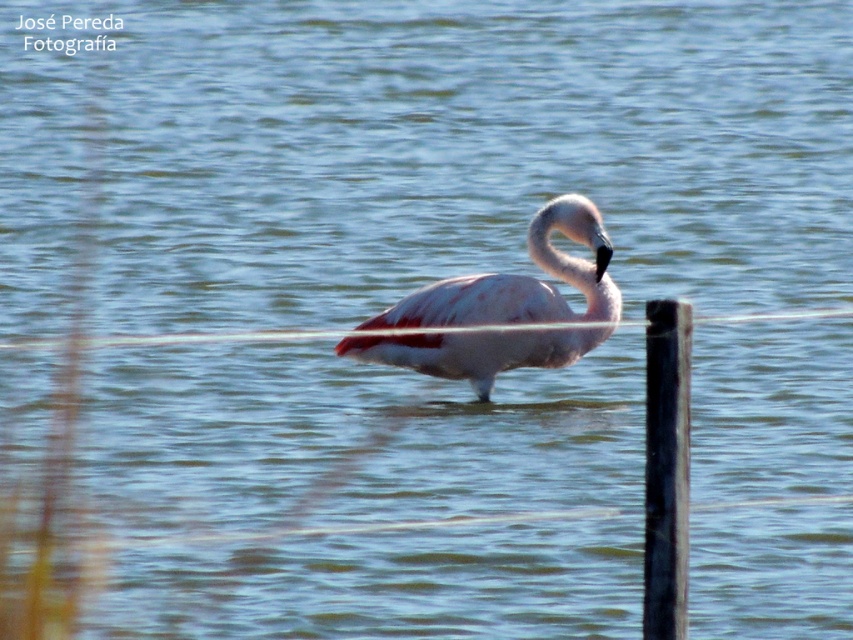
Based on the coordinates provided, can you determine the exact position of the pink feathered flamingo at center in the image?

The pink feathered flamingo at center is located at the 2D coordinates point (520, 280).

You are a photographer trying to capture the flamingo in the image. You want to focus on the point closest to the camera. Which point should you choose between point (527, 314) and point (668, 589)?

Point (527, 314) is further to the camera than point (668, 589), so you should focus on point (527, 314) to capture the closest point to the camera.

You are a photographer trying to capture the pink feathered flamingo at center and the black smooth post at right in the same frame. Based on their heights, which one should you focus on first if you want to ensure both are fully visible in your shot?

The pink feathered flamingo at center is shorter than the black smooth post at right, so you should focus on the black smooth post at right first to ensure both are fully visible in the shot.